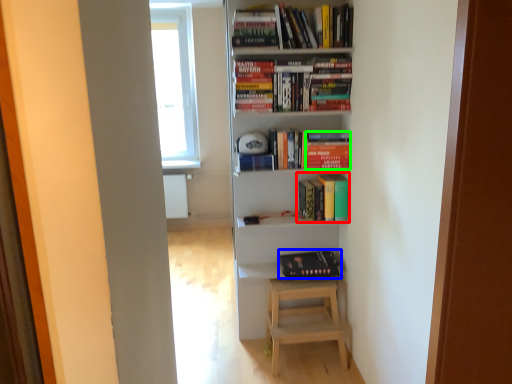
Question: Which object is positioned closest to book (highlighted by a red box)? Select from book (highlighted by a blue box) and paperback book (highlighted by a green box).

Choices:
 (A) book
 (B) paperback book

Answer: (B)